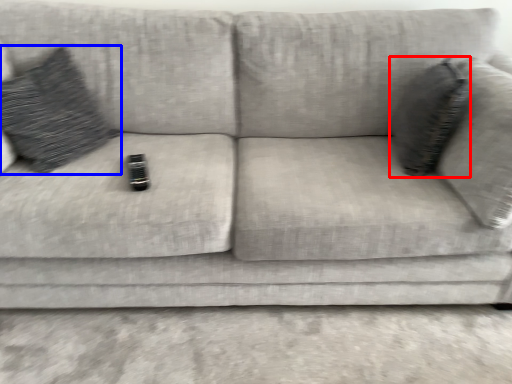
Question: Which object appears closest to the camera in this image, throw pillow (highlighted by a red box) or throw pillow (highlighted by a blue box)?

Choices:
 (A) throw pillow
 (B) throw pillow

Answer: (B)